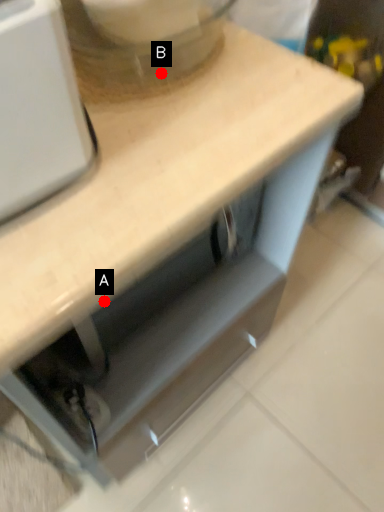
Question: Two points are circled on the image, labeled by A and B beside each circle. Which point is farther from the camera taking this photo?

Choices:
 (A) A is further
 (B) B is further

Answer: (B)